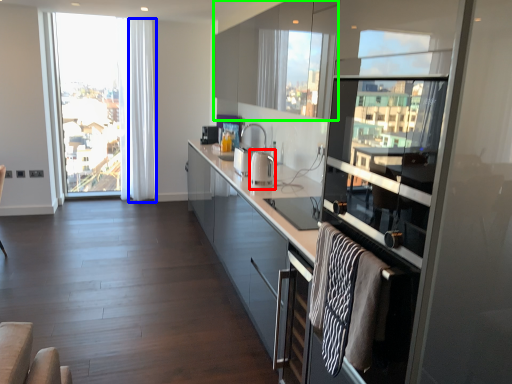
Question: Which object is positioned closest to appliance (highlighted by a red box)? Select from curtain (highlighted by a blue box) and cabinetry (highlighted by a green box).

Choices:
 (A) curtain
 (B) cabinetry

Answer: (B)